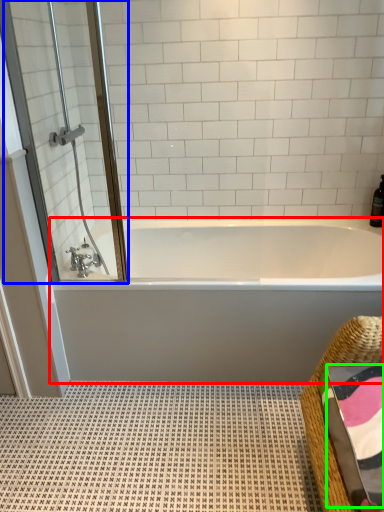
Question: Estimate the real-world distances between objects in this image. Which object is closer to bathtub (highlighted by a red box), screen door (highlighted by a blue box) or bath towel (highlighted by a green box)?

Choices:
 (A) screen door
 (B) bath towel

Answer: (A)